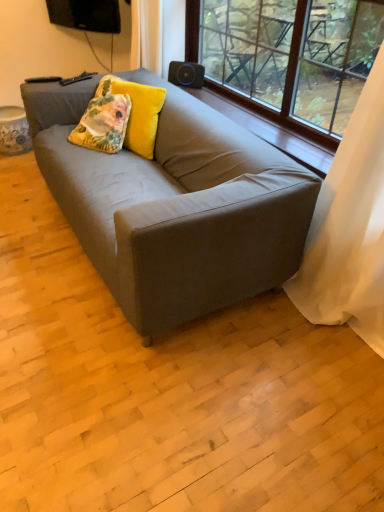
Question: Is point (130, 90) positioned closer to the camera than point (104, 177)?

Choices:
 (A) closer
 (B) farther

Answer: (B)

Question: From a real-world perspective, is floral-patterned velvet pillow at center positioned above or below matte gray couch at center?

Choices:
 (A) below
 (B) above

Answer: (B)

Question: Which of these objects is positioned farthest from the floral-patterned velvet pillow at center?

Choices:
 (A) matte gray couch at center
 (B) floral-patterned velvet pillow at upper left
 (C) white sheer curtain at right
 (D) transparent glass window at upper center
 (E) wooden at upper center

Answer: (D)

Question: Based on their relative distances, which object is farther from the floral-patterned velvet pillow at center?

Choices:
 (A) transparent glass window at upper center
 (B) wooden at upper center
 (C) matte gray couch at center
 (D) floral-patterned velvet pillow at upper left
 (E) white sheer curtain at right

Answer: (A)